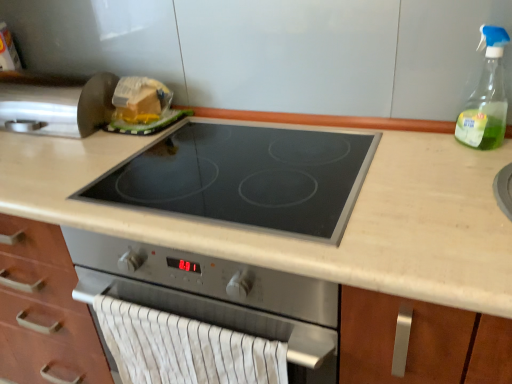
This screenshot has height=384, width=512. Find the location of `vacant space situated above beige laminate countertop at center (from a real-world perspective)`. vacant space situated above beige laminate countertop at center (from a real-world perspective) is located at coordinates [214, 180].